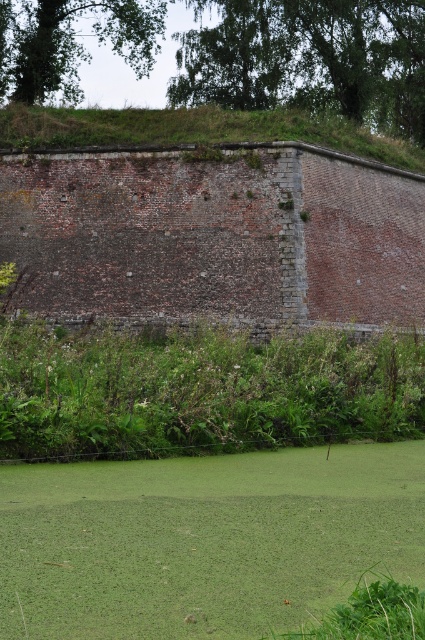
You are standing at the point marked by the coordinates point (204, 540) in the image. Describe your immediate surroundings based on the scene description and the object details provided.

You are standing on green leafy grass at lower center, which is part of the overgrown vegetation lining the edge of the water covered with green algae or duckweed in front of the aged brick wall.